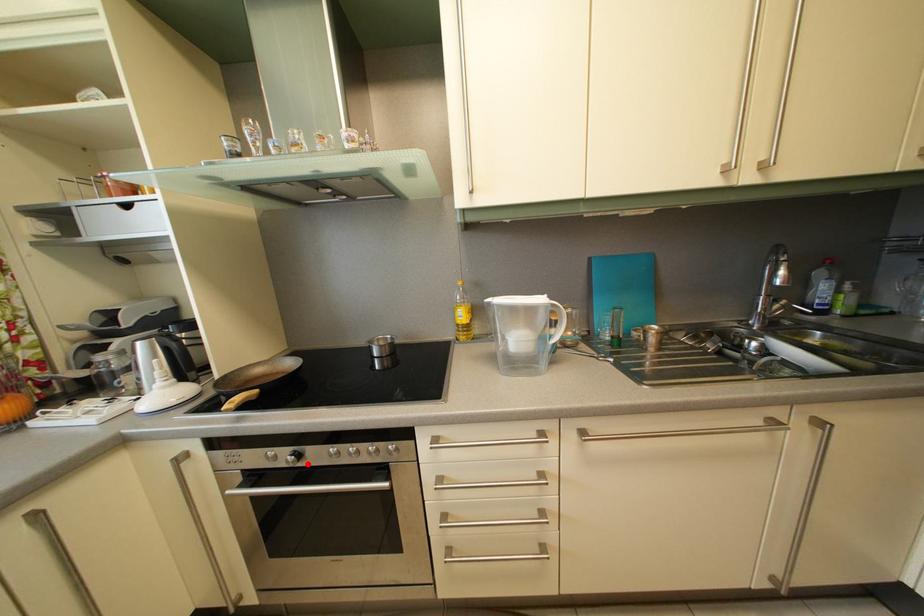
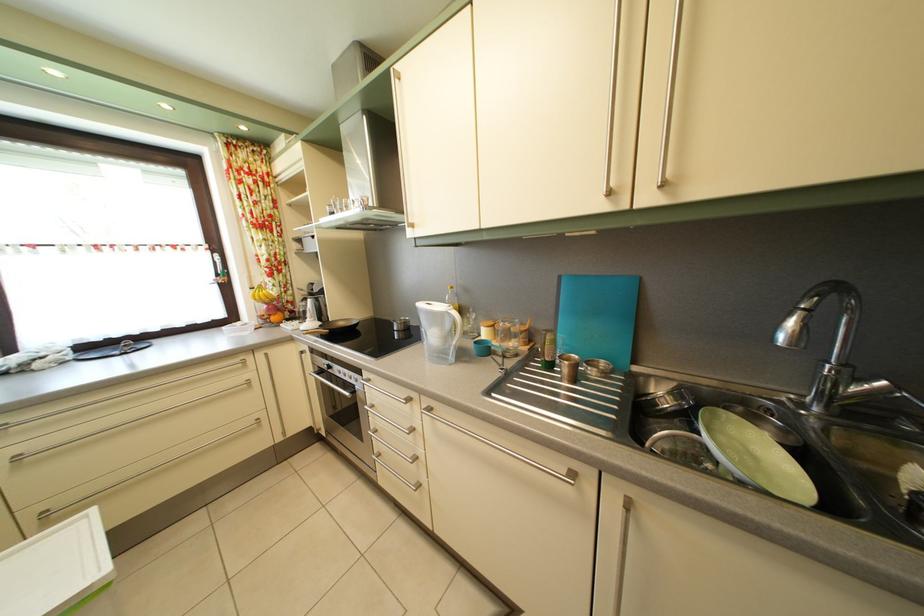
Question: I am providing you with two images of the same scene from different viewpoints. In image1, a red point is highlighted. Considering the same 3D point in image2, which of the following is correct?

Choices:
 (A) It is closer
 (B) It is farther

Answer: (B)